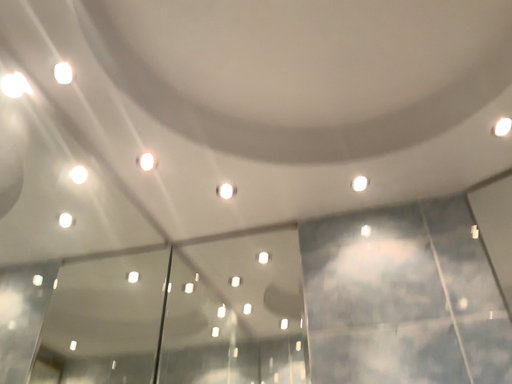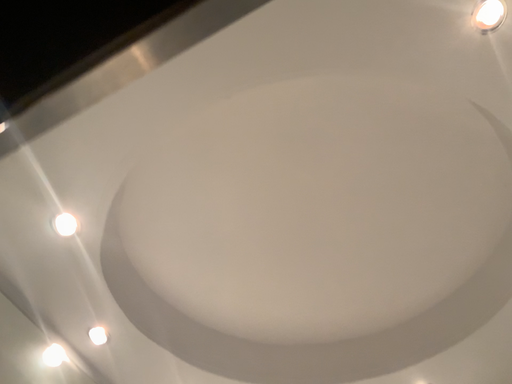
Question: Which way did the camera rotate in the video?

Choices:
 (A) rotated downward
 (B) rotated upward

Answer: (B)